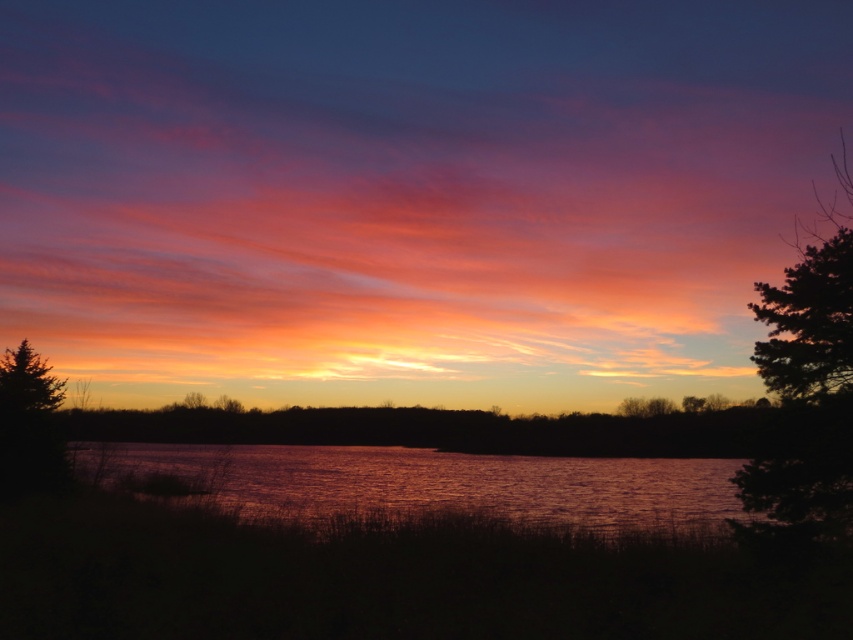
You are an astronomer observing the sunset scene. You notice two points in the sky, one at coordinates point (x=630, y=477) and another at point (x=843, y=372). Which point is closer to the horizon?

Point (x=843, y=372) is closer to the horizon because it is in front of point (x=630, y=477), which is behind it.

You are a photographer trying to capture the sunset. You have a camera with a 24mm lens which has a field of view of 84 degrees. The shiny metallic water at center and the green textured tree at right are both in your frame. Which object would require you to zoom in more to focus on its details?

The green textured tree at right would require zooming in more because it is narrower than the shiny metallic water at center, so to focus on its details, you need a tighter shot.

You are a photographer standing at the edge of the water, wanting to capture both the silhouette tree at right and the green textured tree at right in a single frame. Given that your camera can capture a maximum distance of 150 feet between objects, will you be able to include both trees in your shot?

The silhouette tree at right is 136.11 feet from the green textured tree at right. Since the maximum distance your camera can capture is 150 feet, the 136.11 feet between them is within the range. Therefore, you can include both trees in your shot.